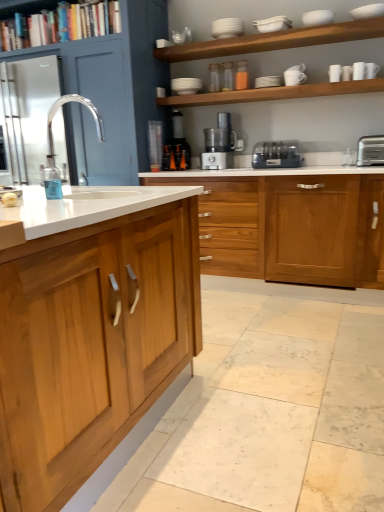
What is the approximate width of wooden cabinet at center, marked as the 1th cabinetry in a back-to-front arrangement?

28.40 inches.

Describe the element at coordinates (291, 228) in the screenshot. The height and width of the screenshot is (512, 384). I see `wooden cabinet at center, which is the second cabinetry in back-to-front order` at that location.

What do you see at coordinates (269, 414) in the screenshot? I see `white marble tile at lower center` at bounding box center [269, 414].

The height and width of the screenshot is (512, 384). I want to click on white matte shelves at upper center, the 2th shelf when ordered from top to bottom, so click(x=274, y=41).

In order to click on silver metallic toaster at right in this screenshot , I will do `click(370, 150)`.

The image size is (384, 512). I want to click on wooden cabinet at center, marked as the 1th cabinetry in a back-to-front arrangement, so click(x=113, y=94).

Is light brown wood cabinet at left, which is counted as the first cabinetry, starting from the front, located outside clear glass faucet at center?

light brown wood cabinet at left, which is counted as the first cabinetry, starting from the front, is positioned outside clear glass faucet at center.

Is point (30, 250) closer to camera compared to point (50, 143)?

Yes, point (30, 250) is closer to viewer.

Which is in front, light brown wood cabinet at left, which is counted as the first cabinetry, starting from the front, or clear glass faucet at center?

light brown wood cabinet at left, which is counted as the first cabinetry, starting from the front, is in front.

Is clear glass faucet at center at the back of light brown wood cabinet at left, which is counted as the first cabinetry, starting from the front?

light brown wood cabinet at left, which is counted as the first cabinetry, starting from the front, does not have its back to clear glass faucet at center.

From the picture: From a real-world perspective, which object stands above the other?

From a 3D spatial view, satin silver metallic food processor at center, which is the 2th home appliance from right to left, is above.

From the image's perspective, is satin silver metallic food processor at center, marked as the first home appliance in a left-to-right arrangement, located above or below satin black toaster at center, positioned as the 1th home appliance in right-to-left order?

From the image's perspective, satin silver metallic food processor at center, marked as the first home appliance in a left-to-right arrangement, appears above satin black toaster at center, positioned as the 1th home appliance in right-to-left order.

Considering the sizes of satin silver metallic food processor at center, which is the 2th home appliance from right to left, and satin black toaster at center, positioned as the 1th home appliance in right-to-left order, in the image, is satin silver metallic food processor at center, which is the 2th home appliance from right to left, taller or shorter than satin black toaster at center, positioned as the 1th home appliance in right-to-left order,?

satin silver metallic food processor at center, which is the 2th home appliance from right to left, is taller than satin black toaster at center, positioned as the 1th home appliance in right-to-left order.

Is the depth of satin silver metallic food processor at center, marked as the first home appliance in a left-to-right arrangement, greater than that of satin black toaster at center, marked as the 2th home appliance in a left-to-right arrangement?

That is True.

Would you consider light brown wood cabinet at left, which is counted as the first cabinetry, starting from the front, to be distant from white matte shelves at upper center, the 2th shelf when ordered from top to bottom?

Yes, light brown wood cabinet at left, which is counted as the first cabinetry, starting from the front, is far from white matte shelves at upper center, the 2th shelf when ordered from top to bottom.

Which object is positioned more to the left, light brown wood cabinet at left, which is counted as the first cabinetry, starting from the front, or white matte shelves at upper center, the 2th shelf when ordered from top to bottom?

light brown wood cabinet at left, which is counted as the first cabinetry, starting from the front, is more to the left.

Is light brown wood cabinet at left, which is counted as the first cabinetry, starting from the front, oriented away from white matte shelves at upper center, the 2th shelf when ordered from top to bottom?

That's not correct — light brown wood cabinet at left, which is counted as the first cabinetry, starting from the front, is not looking away from white matte shelves at upper center, the 2th shelf when ordered from top to bottom.

What's the angular difference between light brown wood cabinet at left, the third cabinetry when ordered from back to front, and white matte shelves at upper center, placed as the 2th shelf when sorted from bottom to top,'s facing directions?

90.2 degrees.

From the image's perspective, is black plastic coffee machine at center under clear glass faucet at center?

Incorrect, from the image's perspective, black plastic coffee machine at center is higher than clear glass faucet at center.

Is black plastic coffee machine at center with clear glass faucet at center?

No, black plastic coffee machine at center is not touching clear glass faucet at center.

Consider the image. Is black plastic coffee machine at center positioned with its back to clear glass faucet at center?

No, black plastic coffee machine at center is not facing away from clear glass faucet at center.

Which is correct: clear glass faucet at center is inside satin silver metallic food processor at center, which is the 2th home appliance from right to left, or outside of it?

clear glass faucet at center is not enclosed by satin silver metallic food processor at center, which is the 2th home appliance from right to left.

From the image's perspective, who appears lower, clear glass faucet at center or satin silver metallic food processor at center, marked as the first home appliance in a left-to-right arrangement?

clear glass faucet at center appears lower in the image.

Between clear glass faucet at center and satin silver metallic food processor at center, which is the 2th home appliance from right to left, which one has more height?

Standing taller between the two is satin silver metallic food processor at center, which is the 2th home appliance from right to left.

How many degrees apart are the facing directions of wooden cabinet at center, which is the second cabinetry in back-to-front order, and white matte shelves at upper center, the 2th shelf when ordered from top to bottom?

They differ by 0.528 degrees in their facing directions.

Looking at this image, which of these two, wooden cabinet at center, which is the second cabinetry in back-to-front order, or white matte shelves at upper center, placed as the 2th shelf when sorted from bottom to top, is bigger?

With larger size is wooden cabinet at center, which is the second cabinetry in back-to-front order.

From a real-world perspective, which is physically below, wooden cabinet at center, which is the second cabinetry in back-to-front order, or white matte shelves at upper center, placed as the 2th shelf when sorted from bottom to top?

From a 3D spatial view, wooden cabinet at center, which is the second cabinetry in back-to-front order, is below.

Is wooden cabinet at center, which ranks as the 2th cabinetry in front-to-back order, to the right of white matte shelves at upper center, placed as the 2th shelf when sorted from bottom to top, from the viewer's perspective?

Yes.

Which of these two, silver metallic toaster at right or satin stainless steel refrigerator at left, stands taller?

With more height is satin stainless steel refrigerator at left.

Is silver metallic toaster at right aimed at satin stainless steel refrigerator at left?

No, silver metallic toaster at right is not aimed at satin stainless steel refrigerator at left.

Is silver metallic toaster at right in front of satin stainless steel refrigerator at left?

Yes, silver metallic toaster at right is closer to the camera.

Identify the location of sink to the right of light brown wood cabinet at left, which is counted as the first cabinetry, starting from the front. This screenshot has width=384, height=512. (51, 127).

Where is `home appliance on the left of satin black toaster at center, marked as the 2th home appliance in a left-to-right arrangement`? home appliance on the left of satin black toaster at center, marked as the 2th home appliance in a left-to-right arrangement is located at coordinates pos(220,144).

Looking at the image, which one is located further to wooden bookshelf at upper left, acting as the third shelf starting from the bottom, black plastic coffee machine at center or satin black toaster at center, positioned as the 1th home appliance in right-to-left order?

The object further to wooden bookshelf at upper left, acting as the third shelf starting from the bottom, is satin black toaster at center, positioned as the 1th home appliance in right-to-left order.

From the image, which object appears to be farther from wooden bookshelf at upper left, acting as the third shelf starting from the bottom, white marble tile at lower center or clear glass faucet at center?

white marble tile at lower center is further to wooden bookshelf at upper left, acting as the third shelf starting from the bottom.

Considering their positions, is silver metallic toaster at right positioned closer to wooden cabinet at center, which ranks as the 2th cabinetry in front-to-back order, than white matte shelves at upper center, placed as the 2th shelf when sorted from bottom to top?

silver metallic toaster at right is positioned closer to the anchor wooden cabinet at center, which ranks as the 2th cabinetry in front-to-back order.

Estimate the real-world distances between objects in this image. Which object is further from wooden cabinet at center, which ranks as the 2th cabinetry in front-to-back order, white matte shelves at upper center, placed as the 2th shelf when sorted from bottom to top, or wooden bookshelf at upper left, the first shelf when ordered from top to bottom?

wooden bookshelf at upper left, the first shelf when ordered from top to bottom, is positioned further to the anchor wooden cabinet at center, which ranks as the 2th cabinetry in front-to-back order.

Based on their spatial positions, is wooden bookshelf at upper left, acting as the third shelf starting from the bottom, or satin stainless steel refrigerator at left further from black plastic coffee machine at center?

satin stainless steel refrigerator at left lies further to black plastic coffee machine at center than the other object.

Considering their positions, is white matte shelves at upper center, placed as the 2th shelf when sorted from bottom to top, positioned closer to white glossy shelves at upper center, the 1th shelf in the bottom-to-top sequence, than black plastic coffee machine at center?

white matte shelves at upper center, placed as the 2th shelf when sorted from bottom to top.

Considering their positions, is wooden bookshelf at upper left, the first shelf when ordered from top to bottom, positioned further to satin silver metallic food processor at center, which is the 2th home appliance from right to left, than clear glass faucet at center?

Among the two, wooden bookshelf at upper left, the first shelf when ordered from top to bottom, is located further to satin silver metallic food processor at center, which is the 2th home appliance from right to left.

From the image, which object appears to be farther from wooden cabinet at center, which is the second cabinetry in back-to-front order, white matte shelves at upper center, the 2th shelf when ordered from top to bottom, or white glossy shelves at upper center, the third shelf viewed from the top?

white matte shelves at upper center, the 2th shelf when ordered from top to bottom, lies further to wooden cabinet at center, which is the second cabinetry in back-to-front order, than the other object.

Where is `ceramic tile between light brown wood cabinet at left, the third cabinetry when ordered from back to front, and wooden cabinet at center, which is the 3th cabinetry from front to back, in the front-back direction`? ceramic tile between light brown wood cabinet at left, the third cabinetry when ordered from back to front, and wooden cabinet at center, which is the 3th cabinetry from front to back, in the front-back direction is located at coordinates (269, 414).

Locate an element on the screen. kitchen appliance between light brown wood cabinet at left, the third cabinetry when ordered from back to front, and satin black toaster at center, positioned as the 1th home appliance in right-to-left order, from front to back is located at coordinates (370, 150).

Image resolution: width=384 pixels, height=512 pixels. Find the location of `kitchen appliance between clear glass faucet at center and satin black toaster at center, marked as the 2th home appliance in a left-to-right arrangement, from front to back`. kitchen appliance between clear glass faucet at center and satin black toaster at center, marked as the 2th home appliance in a left-to-right arrangement, from front to back is located at coordinates (370, 150).

Locate an element on the screen. The width and height of the screenshot is (384, 512). ceramic tile between light brown wood cabinet at left, the third cabinetry when ordered from back to front, and satin black toaster at center, positioned as the 1th home appliance in right-to-left order, in the front-back direction is located at coordinates (269, 414).